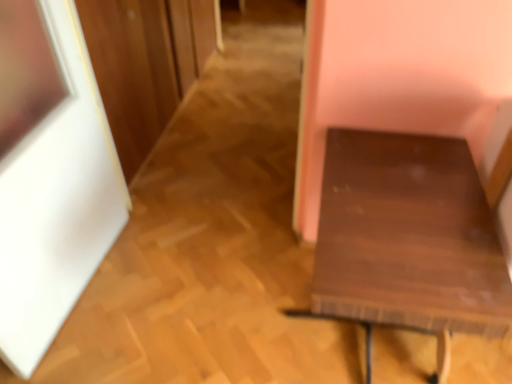
Where is `dark wood table at right`? This screenshot has height=384, width=512. dark wood table at right is located at coordinates [x=407, y=241].

Describe the element at coordinates (407, 241) in the screenshot. I see `dark wood table at right` at that location.

Identify the location of white matte picture frame at left. (50, 176).

Describe the element at coordinates (50, 176) in the screenshot. I see `white matte picture frame at left` at that location.

Find the location of a particular element. dark wood table at right is located at coordinates click(x=407, y=241).

Is dark wood table at right to the right of white matte picture frame at left from the viewer's perspective?

Correct, you'll find dark wood table at right to the right of white matte picture frame at left.

Looking at this image, which object is closer to the camera taking this photo, dark wood table at right or white matte picture frame at left?

white matte picture frame at left is closer to the camera.

Considering the positions of points (381, 225) and (36, 113), is point (381, 225) closer to camera compared to point (36, 113)?

Yes, it is in front of point (36, 113).

From the image's perspective, which object appears higher, dark wood table at right or white matte picture frame at left?

white matte picture frame at left.

From a real-world perspective, who is located lower, dark wood table at right or white matte picture frame at left?

From a 3D spatial view, dark wood table at right is below.

Considering the relative sizes of dark wood table at right and white matte picture frame at left in the image provided, is dark wood table at right wider than white matte picture frame at left?

Correct, the width of dark wood table at right exceeds that of white matte picture frame at left.

Considering the relative sizes of dark wood table at right and white matte picture frame at left in the image provided, is dark wood table at right taller than white matte picture frame at left?

No.

Which of these two, dark wood table at right or white matte picture frame at left, is smaller?

white matte picture frame at left.

Is dark wood table at right inside or outside of white matte picture frame at left?

dark wood table at right is not enclosed by white matte picture frame at left.

Is dark wood table at right beside white matte picture frame at left?

dark wood table at right and white matte picture frame at left are not in contact.

Is dark wood table at right turned away from white matte picture frame at left?

No, dark wood table at right's orientation is not away from white matte picture frame at left.

Can you tell me how much dark wood table at right and white matte picture frame at left differ in facing direction?

93.9 degrees.

How much distance is there between dark wood table at right and white matte picture frame at left?

dark wood table at right is 1.08 meters from white matte picture frame at left.

This screenshot has width=512, height=384. Find the location of `picture frame located above the dark wood table at right (from a real-world perspective)`. picture frame located above the dark wood table at right (from a real-world perspective) is located at coordinates (50, 176).

Which is more to the right, white matte picture frame at left or dark wood table at right?

From the viewer's perspective, dark wood table at right appears more on the right side.

Between white matte picture frame at left and dark wood table at right, which one is positioned behind?

dark wood table at right is more distant.

Does point (9, 364) come behind point (362, 322)?

Yes, point (9, 364) is behind point (362, 322).

From the image's perspective, does white matte picture frame at left appear lower than dark wood table at right?

Incorrect, from the image's perspective, white matte picture frame at left is higher than dark wood table at right.

From a real-world perspective, does white matte picture frame at left sit lower than dark wood table at right?

No, from a real-world perspective, white matte picture frame at left is not below dark wood table at right.

Looking at this image, which object is wider, white matte picture frame at left or dark wood table at right?

With larger width is dark wood table at right.

Is white matte picture frame at left shorter than dark wood table at right?

No.

Considering the relative sizes of white matte picture frame at left and dark wood table at right in the image provided, is white matte picture frame at left smaller than dark wood table at right?

Yes, white matte picture frame at left is smaller than dark wood table at right.

Is dark wood table at right a part of white matte picture frame at left?

No, dark wood table at right is not a part of white matte picture frame at left.

Would you consider white matte picture frame at left to be distant from dark wood table at right?

Indeed, white matte picture frame at left is not near dark wood table at right.

Could you tell me if white matte picture frame at left is facing dark wood table at right?

Yes, white matte picture frame at left is aimed at dark wood table at right.

Find the location of a particular element. This screenshot has height=384, width=512. furniture lying on the right of white matte picture frame at left is located at coordinates [x=407, y=241].

This screenshot has height=384, width=512. Find the location of `picture frame on the left of the dark wood table at right`. picture frame on the left of the dark wood table at right is located at coordinates (50, 176).

Identify the location of furniture on the right of white matte picture frame at left. (x=407, y=241).